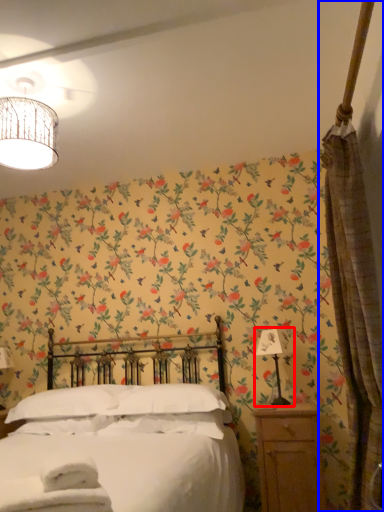
Question: Which of the following is the farthest to the observer, bedside lamp (highlighted by a red box) or curtain (highlighted by a blue box)?

Choices:
 (A) bedside lamp
 (B) curtain

Answer: (A)